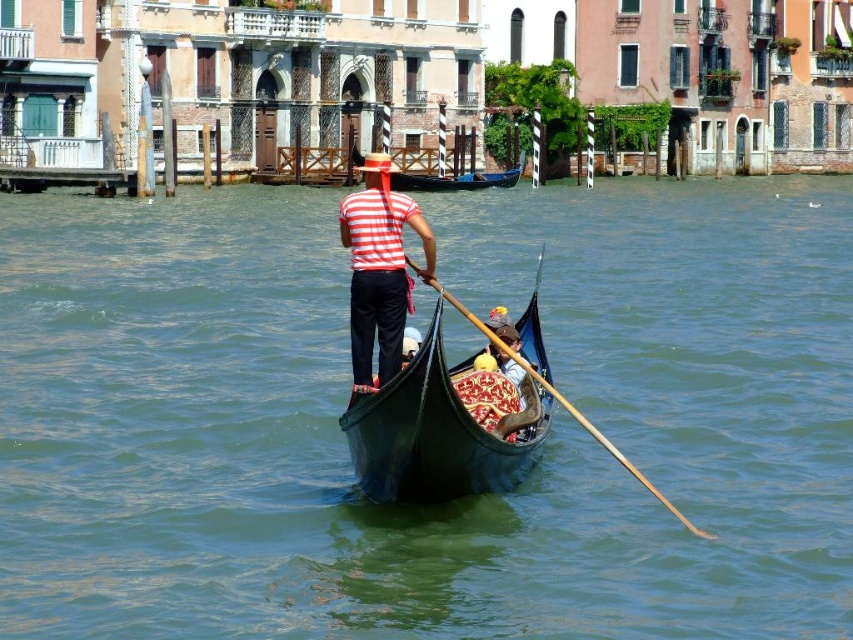
Question: Is green water at center below black glossy canoe at center?

Choices:
 (A) no
 (B) yes

Answer: (B)

Question: Which object is farther from the camera taking this photo?

Choices:
 (A) black glossy canoe at center
 (B) striped fabric shirt at center
 (C) black polished wood canoe at center

Answer: (A)

Question: Can you confirm if striped fabric shirt at center is thinner than wooden at center?

Choices:
 (A) no
 (B) yes

Answer: (B)

Question: Can you confirm if green water at center is wider than wooden at center?

Choices:
 (A) no
 (B) yes

Answer: (B)

Question: Estimate the real-world distances between objects in this image. Which object is closer to the black glossy canoe at center?

Choices:
 (A) green water at center
 (B) striped fabric shirt at center
 (C) black polished wood canoe at center

Answer: (B)

Question: Which object appears closest to the camera in this image?

Choices:
 (A) black polished wood canoe at center
 (B) green water at center
 (C) black glossy canoe at center
 (D) striped fabric shirt at center

Answer: (B)